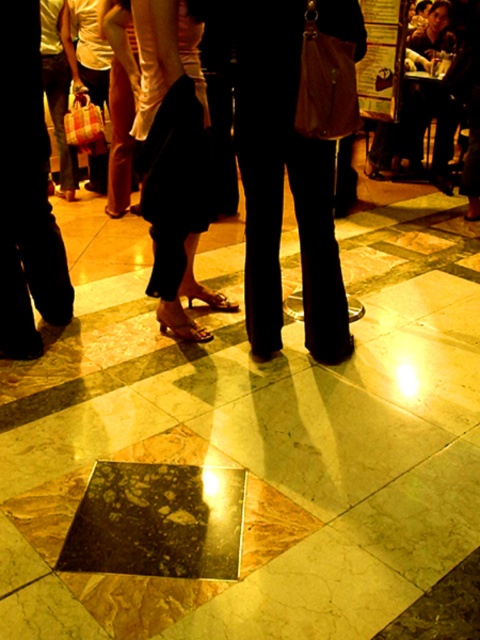
Question: Is dark brown leather pants at center closer to camera compared to black leather pants at left?

Choices:
 (A) no
 (B) yes

Answer: (B)

Question: Which point is farther from the camera taking this photo?

Choices:
 (A) (297, 218)
 (B) (24, 209)

Answer: (B)

Question: Can you confirm if dark brown leather pants at center is positioned below black leather pants at left?

Choices:
 (A) yes
 (B) no

Answer: (A)

Question: Which object is closer to the camera taking this photo?

Choices:
 (A) black leather pants at left
 (B) dark brown leather pants at center

Answer: (B)

Question: Is dark brown leather pants at center wider than black leather pants at left?

Choices:
 (A) yes
 (B) no

Answer: (A)

Question: Among these objects, which one is nearest to the camera?

Choices:
 (A) dark brown leather pants at center
 (B) black leather pants at left

Answer: (A)